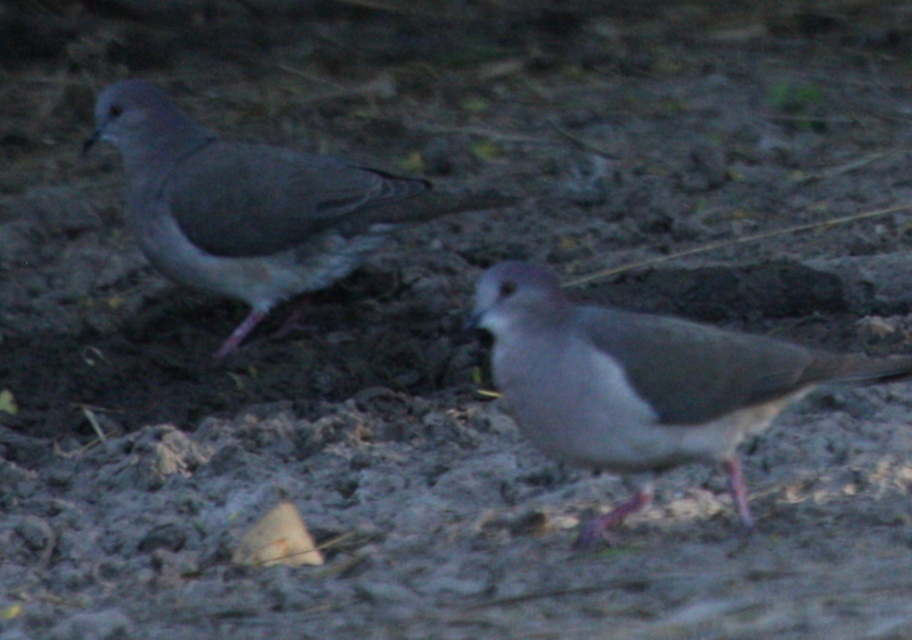
Question: Which of the following is the farthest from the observer?

Choices:
 (A) (258, 252)
 (B) (876, 380)

Answer: (A)

Question: Can you confirm if gray matte dove at center is positioned above gray matte dove at left?

Choices:
 (A) yes
 (B) no

Answer: (B)

Question: Is gray matte dove at center below gray matte dove at left?

Choices:
 (A) yes
 (B) no

Answer: (A)

Question: Is gray matte dove at center positioned behind gray matte dove at left?

Choices:
 (A) no
 (B) yes

Answer: (A)

Question: Which of the following is the farthest from the observer?

Choices:
 (A) gray matte dove at left
 (B) gray matte dove at center

Answer: (A)